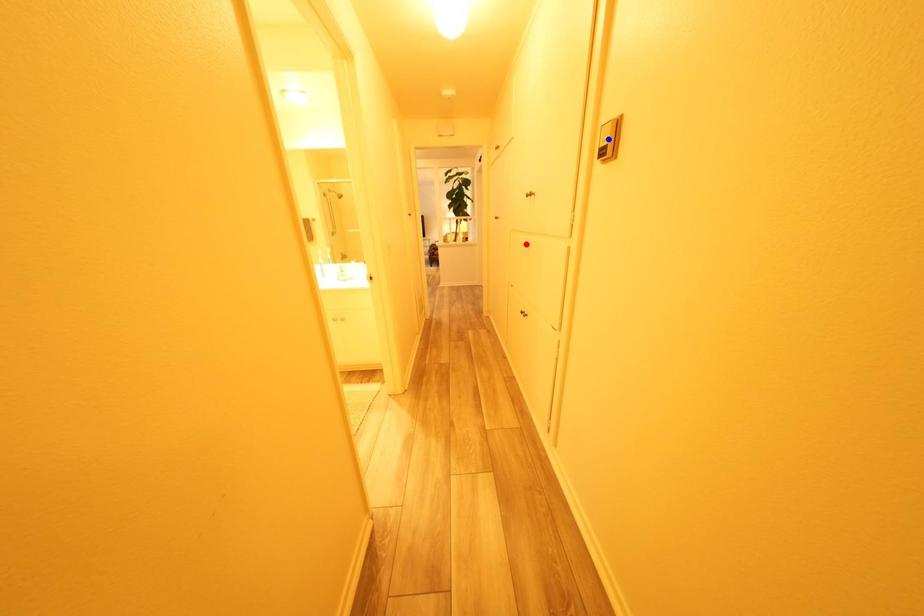
Question: In the image, two points are highlighted. Which point is nearer to the camera? Reply with the corresponding letter.

Choices:
 (A) blue point
 (B) red point

Answer: (A)